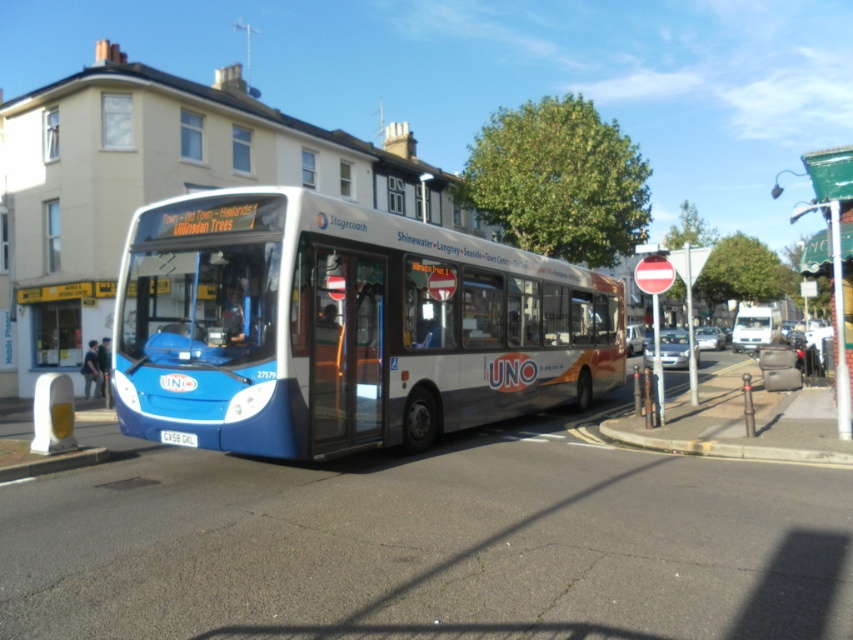
Is blue metallic bus at center bigger than gray concrete curb at lower right?

Indeed, blue metallic bus at center has a larger size compared to gray concrete curb at lower right.

Between blue metallic bus at center and gray concrete curb at lower right, which one is positioned higher?

Positioned higher is blue metallic bus at center.

At what (x,y) coordinates should I click in order to perform the action: click on blue metallic bus at center. Please return your answer as a coordinate pair (x, y). Looking at the image, I should click on (343, 326).

Where is `blue metallic bus at center`? The height and width of the screenshot is (640, 853). blue metallic bus at center is located at coordinates (343, 326).

Does point (494, 276) lie in front of point (734, 323)?

Yes, point (494, 276) is in front of point (734, 323).

Can you confirm if blue metallic bus at center is bigger than white glossy van at right?

Actually, blue metallic bus at center might be smaller than white glossy van at right.

Who is more distant from viewer, (573,346) or (758,308)?

The point (758,308) is behind.

I want to click on blue metallic bus at center, so click(x=343, y=326).

Does gray concrete curb at lower right appear on the right side of white glossy van at right?

Incorrect, gray concrete curb at lower right is not on the right side of white glossy van at right.

Is point (688, 451) more distant than point (744, 339)?

No, it is not.

Where is `gray concrete curb at lower right`? gray concrete curb at lower right is located at coordinates (724, 448).